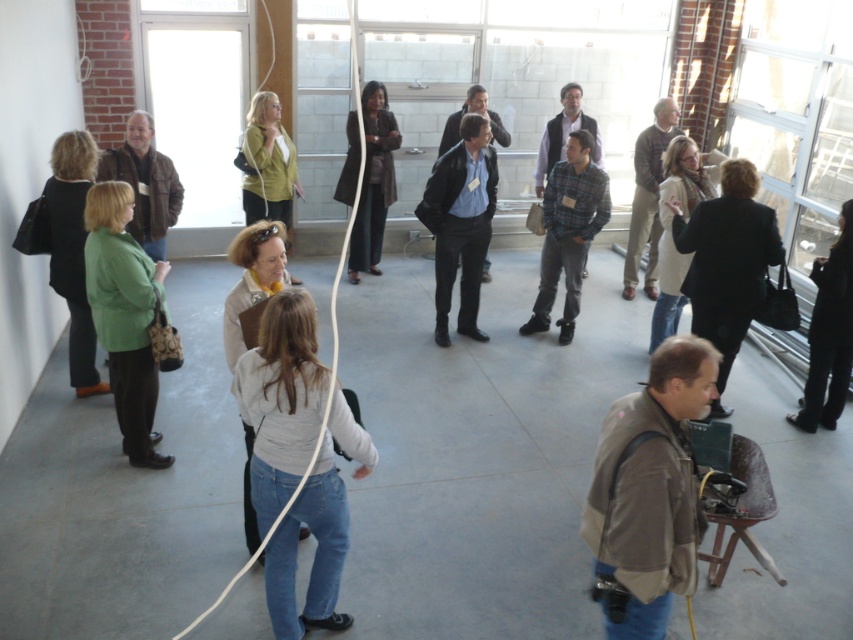
Question: Estimate the real-world distances between objects in this image. Which object is farther from the white matte shirt at center?

Choices:
 (A) light brown hair at center
 (B) dark brown leather jacket at center
 (C) green matte jacket at upper center
 (D) green matte jacket at left

Answer: (B)

Question: Is dark brown leather jacket at center wider than white fabric string at center?

Choices:
 (A) no
 (B) yes

Answer: (A)

Question: Which point is farther to the camera?

Choices:
 (A) white knit sweater at center
 (B) green matte jacket at left

Answer: (A)

Question: Where is green fabric jacket at left located in relation to white fabric string at center in the image?

Choices:
 (A) left
 (B) right

Answer: (A)

Question: Considering the relative positions of white matte shirt at center and black leather jacket at upper right in the image provided, where is white matte shirt at center located with respect to black leather jacket at upper right?

Choices:
 (A) left
 (B) right

Answer: (A)

Question: Which object is closer to the camera taking this photo?

Choices:
 (A) green fabric jacket at left
 (B) black leather jacket at upper right

Answer: (A)